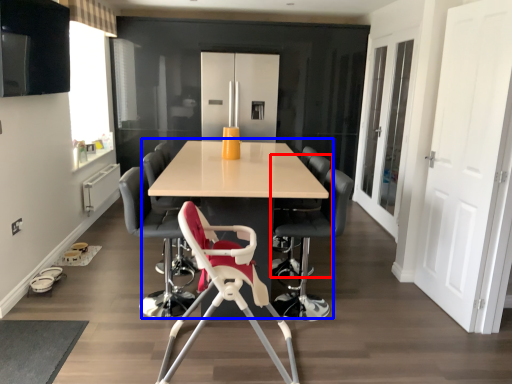
Question: Which object appears farthest to the camera in this image, chair (highlighted by a red box) or table (highlighted by a blue box)?

Choices:
 (A) chair
 (B) table

Answer: (A)